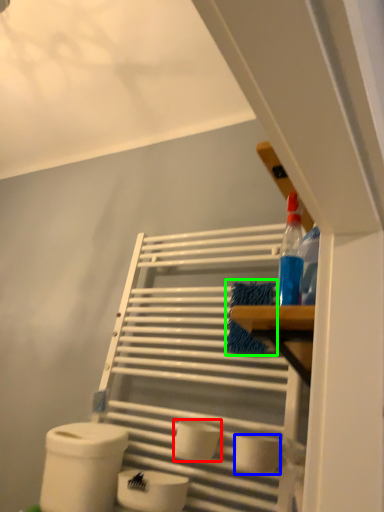
Question: Which is nearer to the toilet paper (highlighted by a red box)? toilet paper (highlighted by a blue box) or material (highlighted by a green box).

Choices:
 (A) toilet paper
 (B) material

Answer: (A)